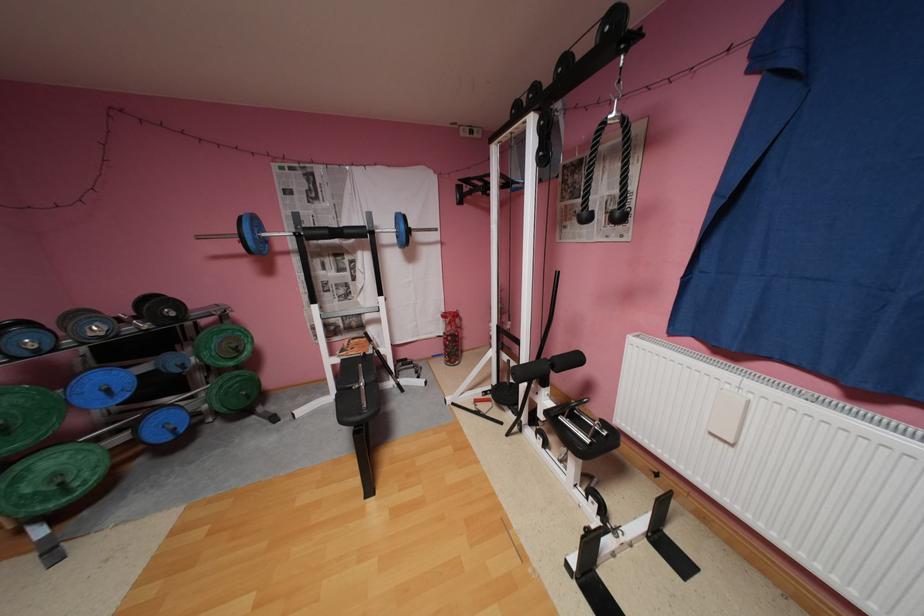
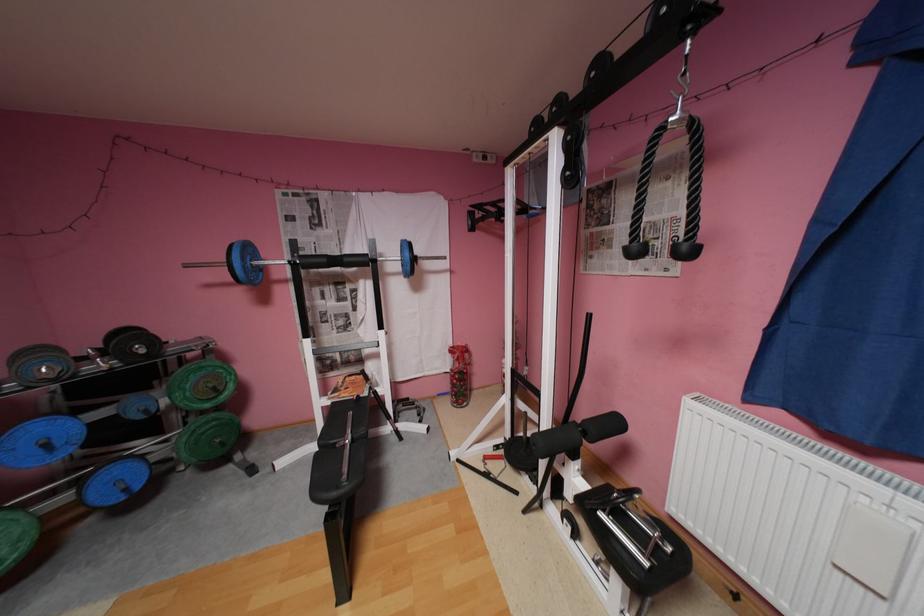
The point at (342, 365) is marked in the first image. Where is the corresponding point in the second image?

(333, 408)